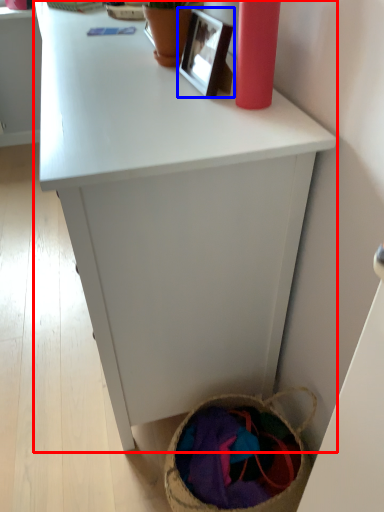
Question: Which point is further to the camera, desk (highlighted by a red box) or picture frame (highlighted by a blue box)?

Choices:
 (A) desk
 (B) picture frame

Answer: (B)